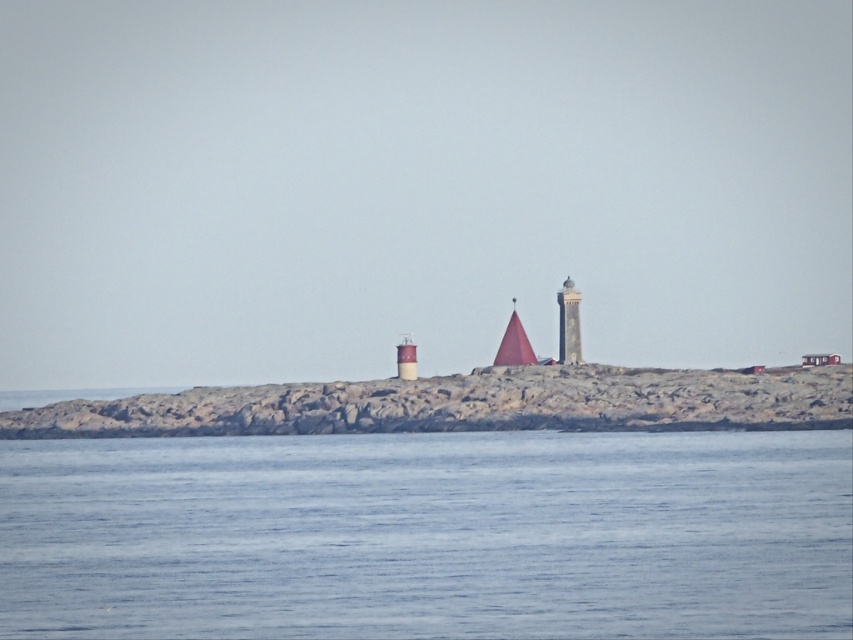
Question: Does rocky island at center have a larger size compared to smooth red cone at center?

Choices:
 (A) yes
 (B) no

Answer: (A)

Question: Estimate the real-world distances between objects in this image. Which object is closer to the rocky island at center?

Choices:
 (A) smooth gray tower at center
 (B) smooth red cone at center
 (C) blue water at center

Answer: (B)

Question: Is rocky island at center to the left of smooth brown tower at center from the viewer's perspective?

Choices:
 (A) yes
 (B) no

Answer: (A)

Question: Which object is positioned farthest from the smooth gray tower at center?

Choices:
 (A) smooth brown tower at center
 (B) blue water at center
 (C) rocky island at center
 (D) smooth red cone at center

Answer: (B)

Question: Is rocky island at center below smooth red cone at center?

Choices:
 (A) no
 (B) yes

Answer: (B)

Question: Which of these objects is positioned closest to the smooth brown tower at center?

Choices:
 (A) smooth gray tower at center
 (B) rocky island at center

Answer: (A)